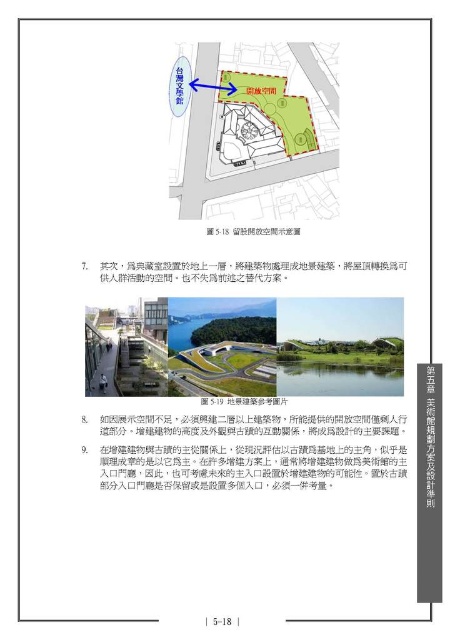
Which is more to the right, green matte building at center or green reflective water at center?

From the viewer's perspective, green reflective water at center appears more on the right side.

Can you confirm if green matte building at center is smaller than green reflective water at center?

No, green matte building at center is not smaller than green reflective water at center.

The height and width of the screenshot is (640, 450). What do you see at coordinates (256, 131) in the screenshot? I see `green matte building at center` at bounding box center [256, 131].

You are a GUI agent. You are given a task and a screenshot of the screen. Output one action in this format:
    pyautogui.click(x=<x>, y=<y>)
    Task: Click on the green matte building at center
    This screenshot has height=640, width=450.
    Given the screenshot: What is the action you would take?
    pyautogui.click(x=256, y=131)